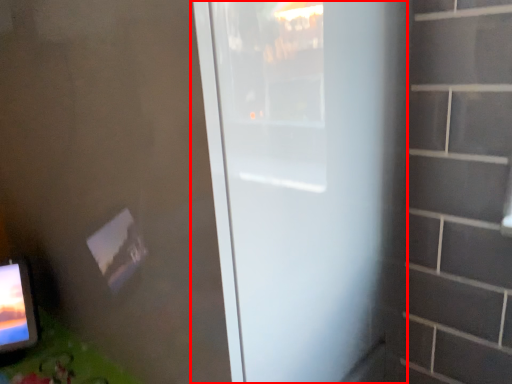
Question: Where is door (annotated by the red box) located in relation to table in the image?

Choices:
 (A) left
 (B) right

Answer: (B)